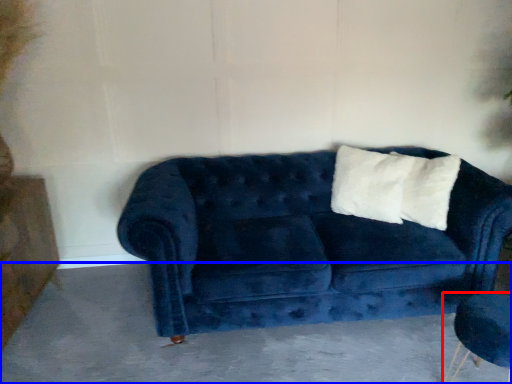
Question: Which point is closer to the camera, armchair (highlighted by a red box) or concrete (highlighted by a blue box)?

Choices:
 (A) armchair
 (B) concrete

Answer: (A)